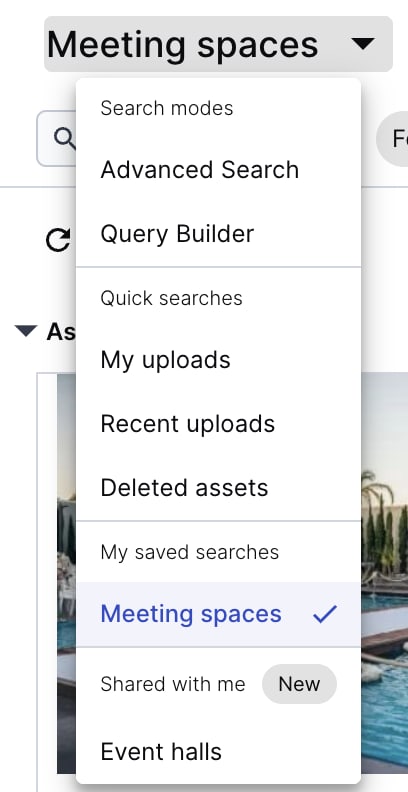
This screenshot has height=792, width=408. Find the location of `event halls`. event halls is located at coordinates (130, 752).